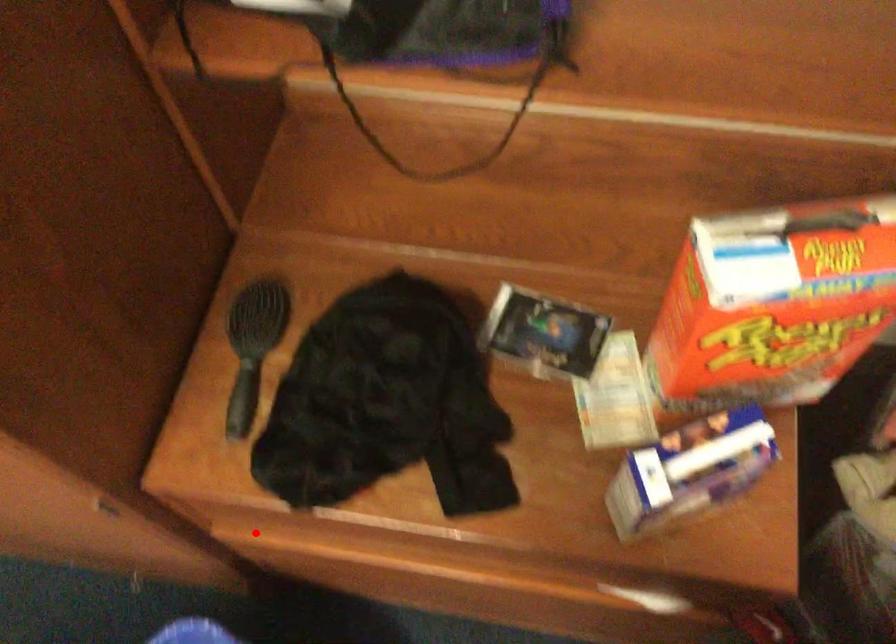
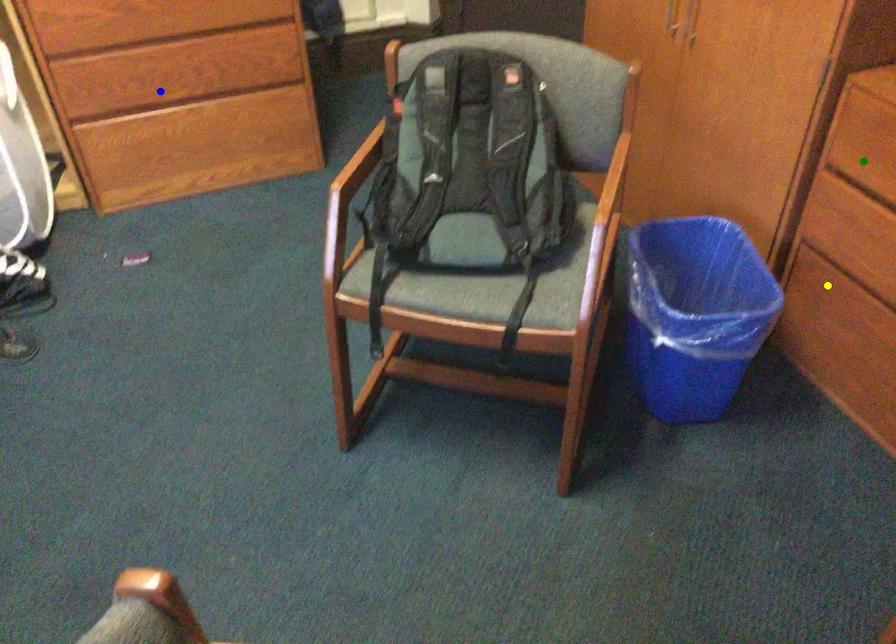
Question: I am providing you with two images of the same scene from different viewpoints. A red point is marked on the first image. You are given multiple points on the second image. In image 2, which mark is for the same physical point as the one in image 1?

Choices:
 (A) yellow point
 (B) blue point
 (C) green point

Answer: (C)